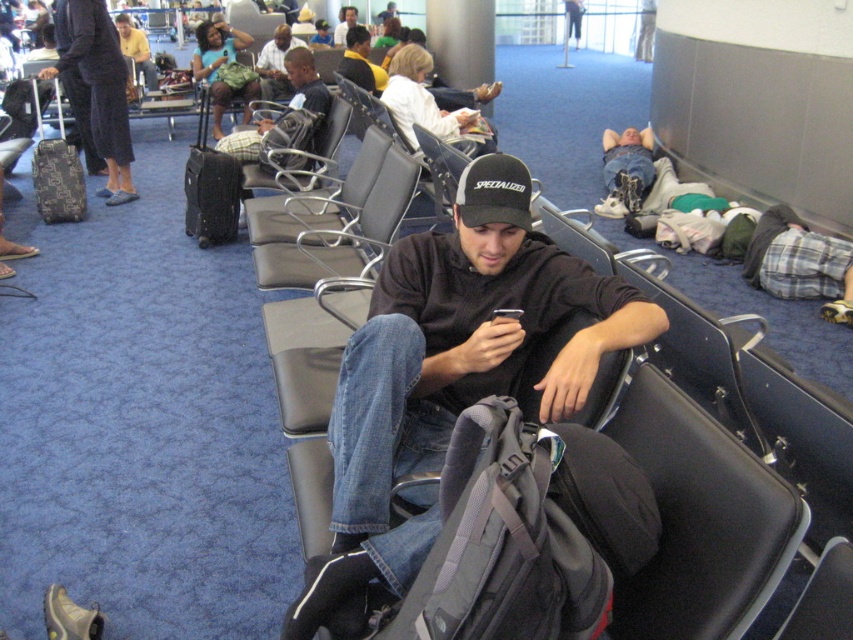
You are a traveler who just arrived at the airport and need to place your dark gray hoodie at center and patterned fabric suitcase at left. Based on the scene description, where should you position them relative to each other?

The dark gray hoodie at center should be placed below the patterned fabric suitcase at left as per the description.

You are a traveler who just arrived in the airport waiting area. You see a dark gray hoodie at center and a patterned fabric suitcase at left. Which object is taller?

The dark gray hoodie at center is taller than the patterned fabric suitcase at left.

You are a passenger looking for your seat in the airport waiting area. You see the dark gray hoodie at center. Based on its position, can you determine if it is closer to the front or the back of the seating area?

The dark gray hoodie at center is located at point (447, 378), which places it closer to the front of the seating area since the coordinates are closer to the lower end of the coordinate system typically used in such scenarios.